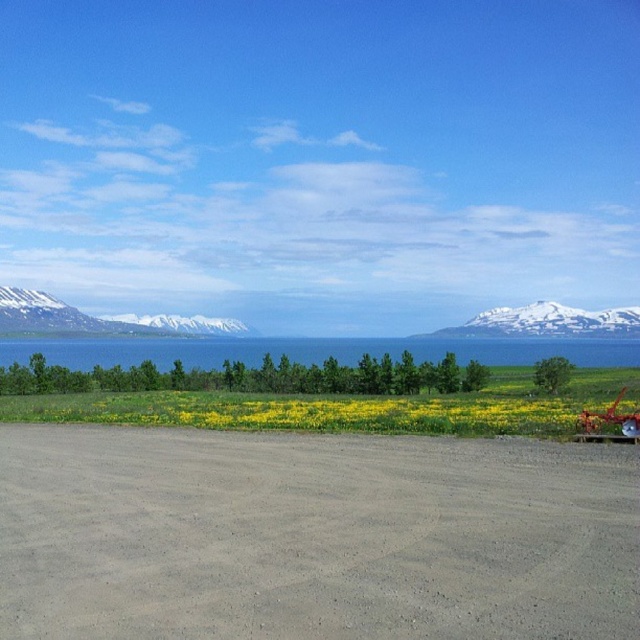
Question: Which point is farther to the camera?

Choices:
 (A) blue water at center
 (B) yellow matte flower at center
 (C) white snow-covered mountain at left

Answer: (C)

Question: Is gray gravel dirt track at center smaller than yellow matte flower at center?

Choices:
 (A) yes
 (B) no

Answer: (A)

Question: Which point is closer to the camera taking this photo?

Choices:
 (A) (497, 428)
 (B) (227, 353)
 (C) (465, 592)

Answer: (C)

Question: Does blue water at center come behind snowy rock mountain at upper right?

Choices:
 (A) no
 (B) yes

Answer: (A)

Question: Which object appears farthest from the camera in this image?

Choices:
 (A) gray gravel dirt track at center
 (B) yellow matte flower at center
 (C) snowy rock mountain at upper right
 (D) snowy mountain at center

Answer: (D)

Question: Is snowy rock mountain at upper right to the left of snowy mountain at center from the viewer's perspective?

Choices:
 (A) yes
 (B) no

Answer: (B)